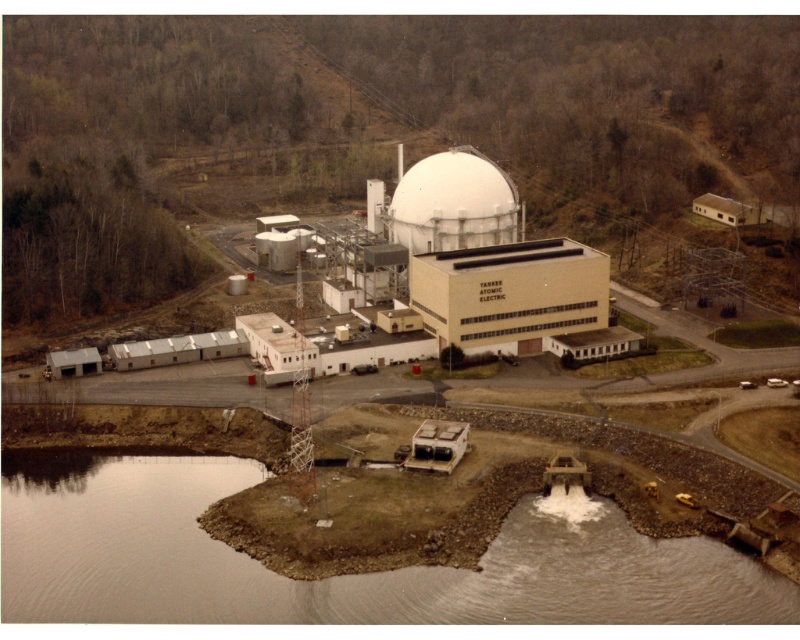
Question: Does white matte building at center have a larger size compared to white matte dome at center?

Choices:
 (A) no
 (B) yes

Answer: (B)

Question: Does smooth concrete dam at lower center have a larger size compared to white matte dome at center?

Choices:
 (A) no
 (B) yes

Answer: (B)

Question: Is white matte building at center to the left of white matte dome at center from the viewer's perspective?

Choices:
 (A) no
 (B) yes

Answer: (B)

Question: Which object is the farthest from the white matte dome at center?

Choices:
 (A) smooth concrete dam at lower center
 (B) white matte building at center

Answer: (A)

Question: Based on their relative distances, which object is nearer to the white matte dome at center?

Choices:
 (A) white matte building at center
 (B) smooth concrete dam at lower center

Answer: (A)

Question: Which point appears farthest from the camera in this image?

Choices:
 (A) (316, 604)
 (B) (532, 241)
 (C) (464, 193)

Answer: (B)